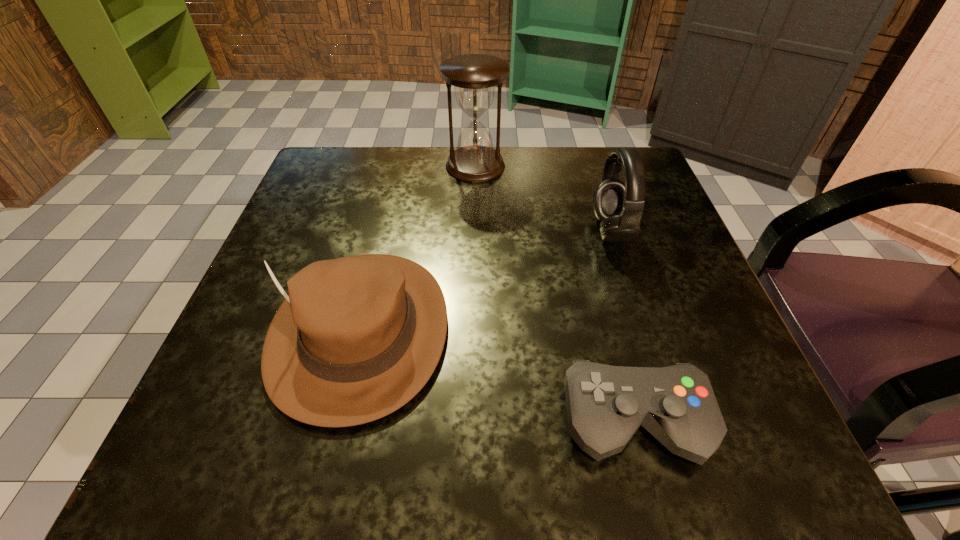
Find the location of a particular element. the tallest object is located at coordinates (474, 76).

The width and height of the screenshot is (960, 540). Identify the location of the farthest object. (474, 76).

Find the location of a particular element. headset is located at coordinates (619, 206).

This screenshot has height=540, width=960. I want to click on fedora, so click(356, 338).

The image size is (960, 540). Find the location of `the shortest object`. the shortest object is located at coordinates (606, 405).

The width and height of the screenshot is (960, 540). I want to click on free space located on the left of the hourglass, so click(387, 166).

Locate an element on the screen. vacant space positioned on the earcups of the headset is located at coordinates (546, 231).

Locate an element on the screen. vacant space located 0.360m on the earcups of the headset is located at coordinates (x=402, y=231).

The height and width of the screenshot is (540, 960). I want to click on vacant area situated on the earcups of the headset, so click(x=455, y=231).

Find the location of a particular element. This screenshot has height=540, width=960. free space located 0.050m on the feather side of the fedora is located at coordinates (326, 472).